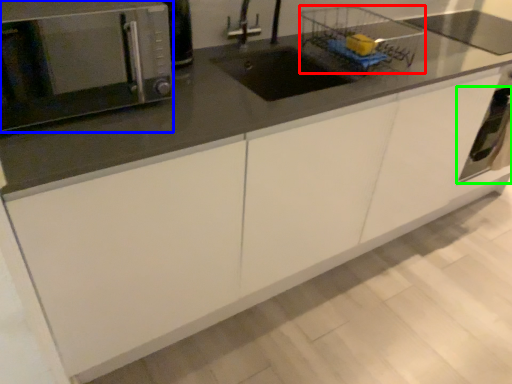
Question: Estimate the real-world distances between objects in this image. Which object is farther from basket (highlighted by a red box), microwave oven (highlighted by a blue box) or oven (highlighted by a green box)?

Choices:
 (A) microwave oven
 (B) oven

Answer: (A)